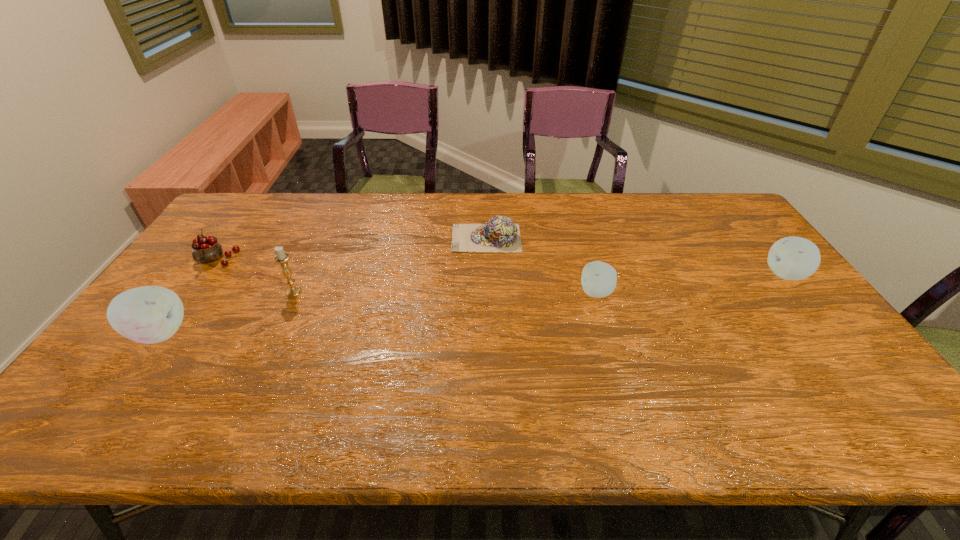
Please point a spot to place another apple for symmetrical spacing. Please provide its 2D coordinates. Your answer should be formatted as a tuple, i.e. [(x, y)], where the tuple contains the x and y coordinates of a point satisfying the conditions above.

[(389, 312)]